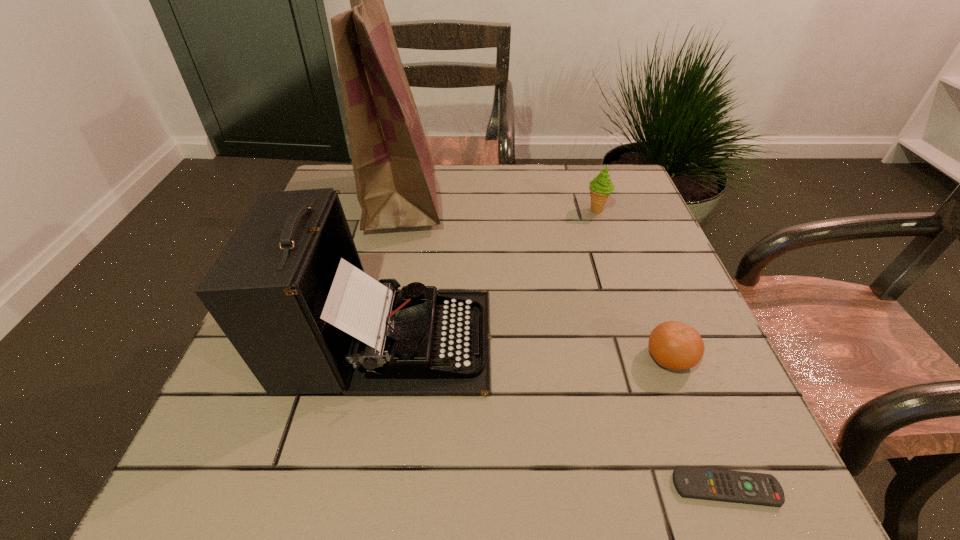
The height and width of the screenshot is (540, 960). In order to click on free space that satisfies the following two spatial constraints: 1. inside the open case of the second shortest object; 2. on the left side of the fourth shortest object in this screenshot , I will do `click(382, 358)`.

Identify the location of vacant space that satisfies the following two spatial constraints: 1. on the front side of the third shortest object; 2. on the left side of the clementine. (647, 358).

Find the location of `free point that satisfies the following two spatial constraints: 1. on the front-facing side of the grocery bag; 2. on the left side of the nearest object`. free point that satisfies the following two spatial constraints: 1. on the front-facing side of the grocery bag; 2. on the left side of the nearest object is located at coordinates (334, 488).

You are a GUI agent. You are given a task and a screenshot of the screen. Output one action in this format:
    pyautogui.click(x=<x>, y=<y>)
    Task: Click on the vacant area that satisfies the following two spatial constraints: 1. on the front-facing side of the grocery bag; 2. on the left side of the icecream
    The width and height of the screenshot is (960, 540).
    Given the screenshot: What is the action you would take?
    pyautogui.click(x=399, y=210)